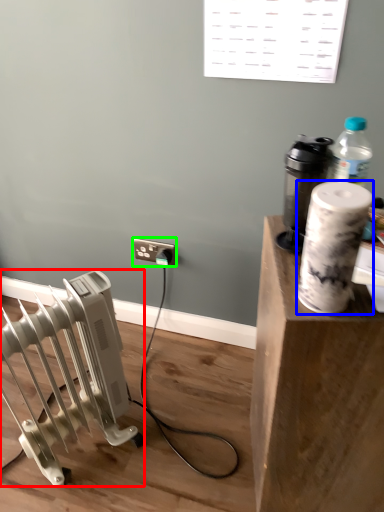
Question: Which object is positioned farthest from radiator (highlighted by a red box)? Select from paper towel (highlighted by a blue box) and electric outlet (highlighted by a green box).

Choices:
 (A) paper towel
 (B) electric outlet

Answer: (A)